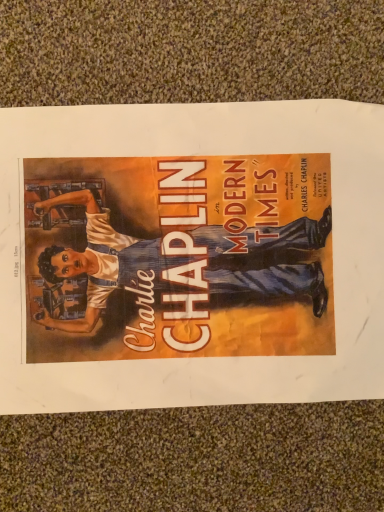
I want to click on matte paper poster at center, so click(x=208, y=154).

The height and width of the screenshot is (512, 384). What do you see at coordinates (208, 154) in the screenshot?
I see `matte paper poster at center` at bounding box center [208, 154].

Where is `matte paper poster at center`? matte paper poster at center is located at coordinates (208, 154).